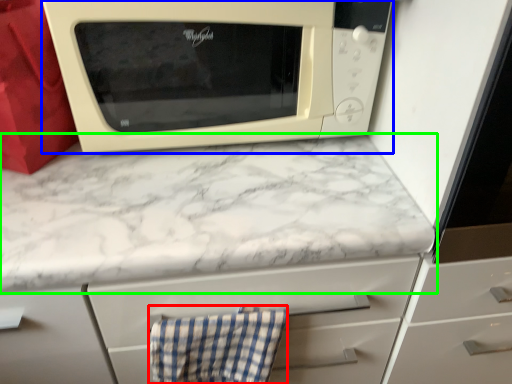
Question: Which object is positioned closest to hand towel (highlighted by a red box)? Select from microwave oven (highlighted by a blue box) and countertop (highlighted by a green box).

Choices:
 (A) microwave oven
 (B) countertop

Answer: (B)